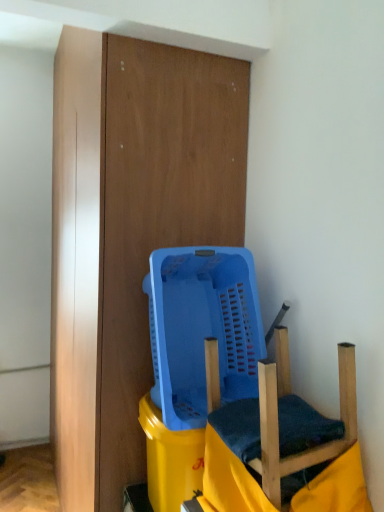
Question: From a real-world perspective, is wooden swivel chair at lower right above or below blue plastic basket at center?

Choices:
 (A) above
 (B) below

Answer: (B)

Question: Is wooden swivel chair at lower right inside or outside of blue plastic basket at center?

Choices:
 (A) outside
 (B) inside

Answer: (A)

Question: From their relative heights in the image, would you say wooden swivel chair at lower right is taller or shorter than blue plastic basket at center?

Choices:
 (A) tall
 (B) short

Answer: (B)

Question: From a real-world perspective, relative to wooden swivel chair at lower right, is blue plastic basket at center vertically above or below?

Choices:
 (A) below
 (B) above

Answer: (B)

Question: Does point (183, 281) appear closer or farther from the camera than point (278, 474)?

Choices:
 (A) closer
 (B) farther

Answer: (B)

Question: Choose the correct answer: Is blue plastic basket at center inside wooden swivel chair at lower right or outside it?

Choices:
 (A) outside
 (B) inside

Answer: (A)

Question: Is blue plastic basket at center bigger or smaller than wooden swivel chair at lower right?

Choices:
 (A) big
 (B) small

Answer: (A)